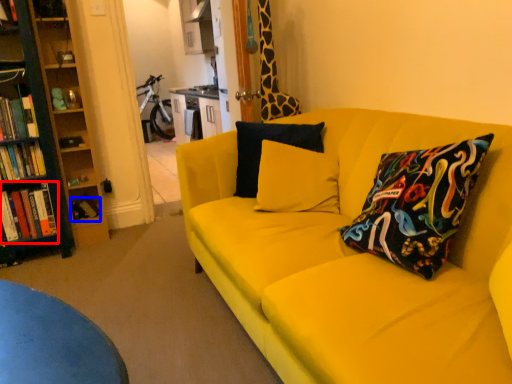
Question: Which point is further to the camera, book (highlighted by a red box) or book (highlighted by a blue box)?

Choices:
 (A) book
 (B) book

Answer: (B)